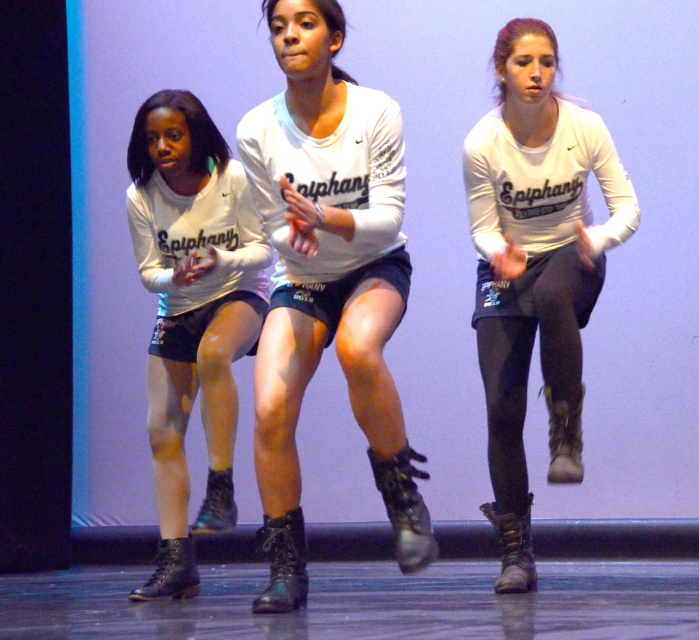
From the picture: You are a photographer standing at the back of the stage. You want to take a closeup photo of the matte black shorts at center. The camera you have can focus on objects within 3 meters. Will you be able to capture a clear closeup shot?

The matte black shorts at center is 3.40 meters away from the viewer, which is beyond the camera focus range of 3 meters. Therefore, you cannot capture a clear closeup shot.

You are a stagehand setting up a ladder to adjust the lighting above the stage. You need to reach the highest point between the matte black shorts at center and the matte black boots at center. Which object should you aim for?

The matte black shorts at center is taller than the matte black boots at center, so you should aim for the matte black shorts at center to reach the highest point.